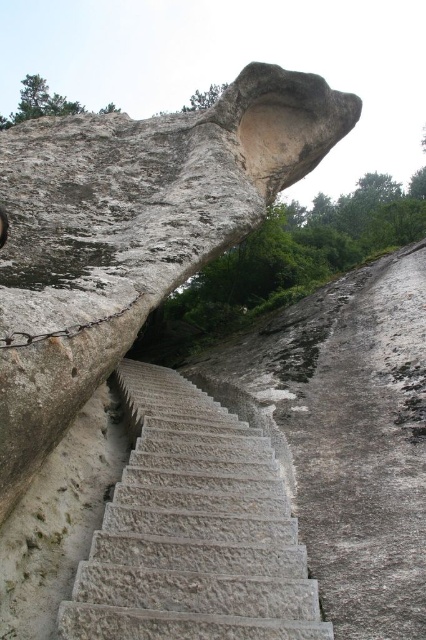
Question: Is smooth gray rock at center bigger than gray stone stairs at center?

Choices:
 (A) no
 (B) yes

Answer: (B)

Question: Is smooth gray rock at center to the right of gray stone stairs at center from the viewer's perspective?

Choices:
 (A) yes
 (B) no

Answer: (B)

Question: Which point appears closest to the camera in this image?

Choices:
 (A) (126, 301)
 (B) (218, 620)

Answer: (B)

Question: In this image, where is smooth gray rock at center located relative to gray stone stairs at center?

Choices:
 (A) below
 (B) above

Answer: (B)